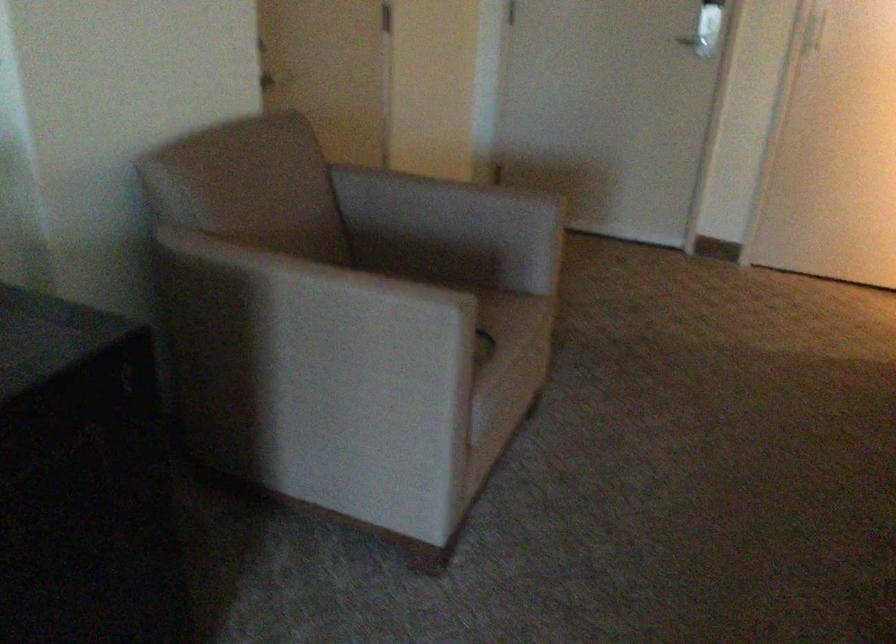
Find the location of `chair sitting surface`. chair sitting surface is located at coordinates (513, 345).